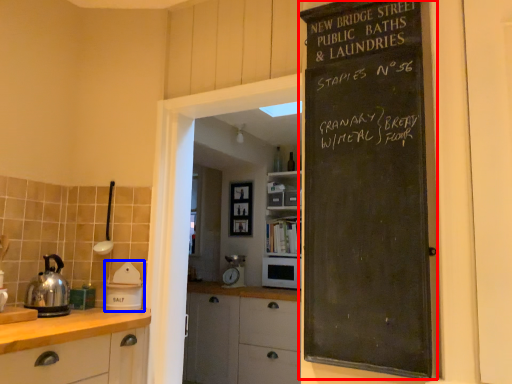
Question: Which point is further to the camera, bulletin board (highlighted by a red box) or appliance (highlighted by a blue box)?

Choices:
 (A) bulletin board
 (B) appliance

Answer: (B)